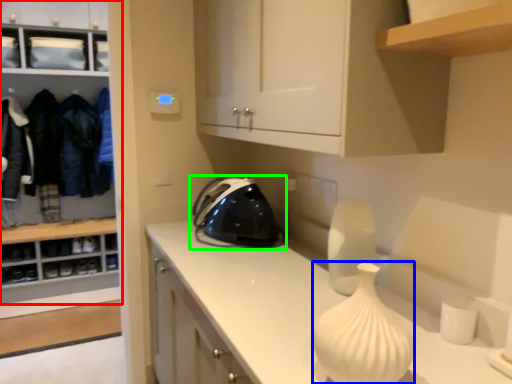
Question: Which is nearer to the cabinetry (highlighted by a red box)? glass vase (highlighted by a blue box) or home appliance (highlighted by a green box).

Choices:
 (A) glass vase
 (B) home appliance

Answer: (B)